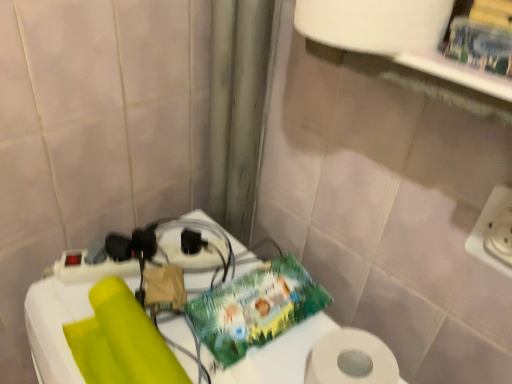
Question: Is white plastic table at lower left facing away from black plastic socket at center?

Choices:
 (A) no
 (B) yes

Answer: (A)

Question: Could you tell me if white plastic table at lower left is turned towards black plastic socket at center?

Choices:
 (A) yes
 (B) no

Answer: (B)

Question: Can you confirm if white plastic table at lower left is thinner than black plastic socket at center?

Choices:
 (A) no
 (B) yes

Answer: (A)

Question: Is white plastic table at lower left to the left of black plastic socket at center from the viewer's perspective?

Choices:
 (A) no
 (B) yes

Answer: (A)

Question: From the image's perspective, would you say white plastic table at lower left is shown under black plastic socket at center?

Choices:
 (A) yes
 (B) no

Answer: (A)

Question: In the image, is white plastic table at lower left on the left side or the right side of black plastic socket at center?

Choices:
 (A) left
 (B) right

Answer: (B)

Question: In terms of width, does white plastic table at lower left look wider or thinner when compared to black plastic socket at center?

Choices:
 (A) thin
 (B) wide

Answer: (B)

Question: Considering the positions of white plastic table at lower left and black plastic socket at center in the image, is white plastic table at lower left taller or shorter than black plastic socket at center?

Choices:
 (A) tall
 (B) short

Answer: (A)

Question: From a real-world perspective, is white plastic table at lower left above or below black plastic socket at center?

Choices:
 (A) above
 (B) below

Answer: (B)

Question: From the image's perspective, relative to white plastic table at lower left, is black plastic socket at center above or below?

Choices:
 (A) below
 (B) above

Answer: (B)

Question: Considering the positions of black plastic socket at center and white plastic table at lower left in the image, is black plastic socket at center wider or thinner than white plastic table at lower left?

Choices:
 (A) thin
 (B) wide

Answer: (A)

Question: Considering their positions, is black plastic socket at center located in front of or behind white plastic table at lower left?

Choices:
 (A) behind
 (B) front

Answer: (A)

Question: Is black plastic socket at center taller or shorter than white plastic table at lower left?

Choices:
 (A) short
 (B) tall

Answer: (A)

Question: From the image's perspective, is white plastic electric outlet at right located above or below white plastic table at lower left?

Choices:
 (A) above
 (B) below

Answer: (A)

Question: Considering their positions, is white plastic electric outlet at right located in front of or behind white plastic table at lower left?

Choices:
 (A) front
 (B) behind

Answer: (B)